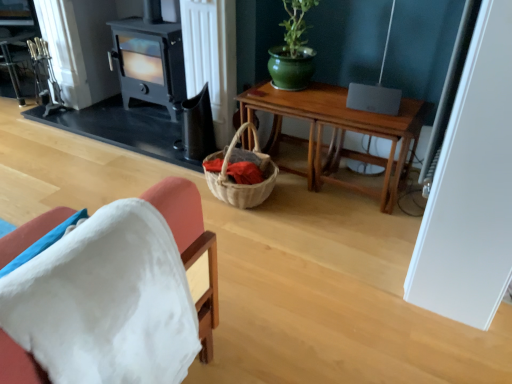
Question: Looking at their shapes, would you say black matte fireplace at center is wider or thinner than white fabric chair at lower left?

Choices:
 (A) thin
 (B) wide

Answer: (A)

Question: Relative to white fabric chair at lower left, is black matte fireplace at center in front or behind?

Choices:
 (A) behind
 (B) front

Answer: (A)

Question: Estimate the real-world distances between objects in this image. Which object is closer to the black matte fireplace at center?

Choices:
 (A) white fabric chair at lower left
 (B) wooden table at center

Answer: (B)

Question: Estimate the real-world distances between objects in this image. Which object is farther from the black matte fireplace at center?

Choices:
 (A) white fabric chair at lower left
 (B) wooden table at center

Answer: (A)